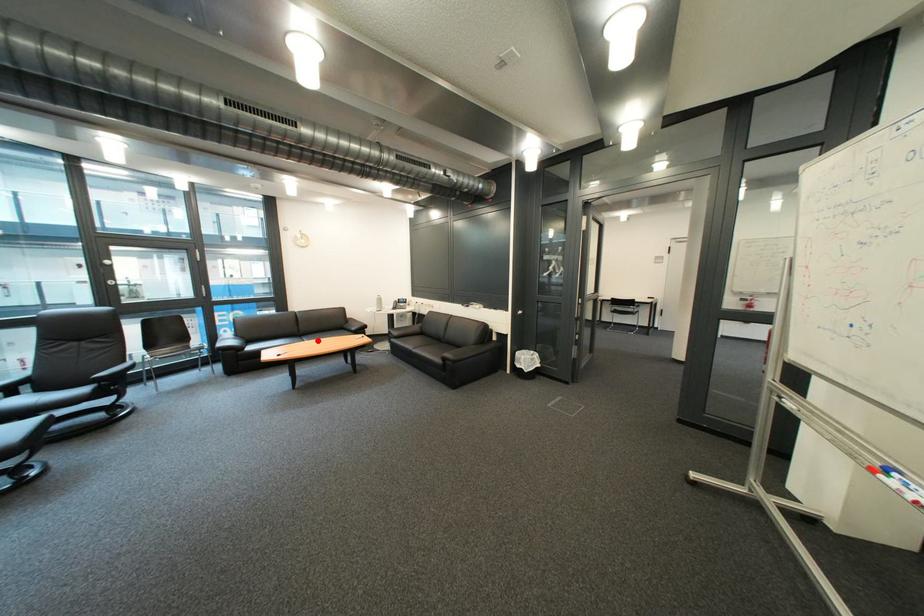
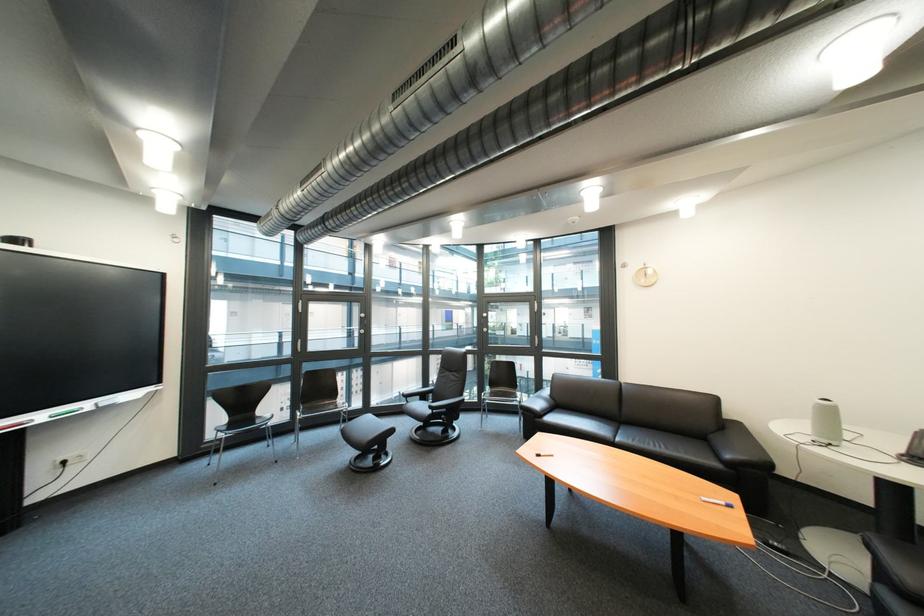
Question: I am providing you with two images of the same scene from different viewpoints. A red point is marked on the first image. At the location where the point appears in image 1, is it still visible in image 2?

Choices:
 (A) Yes
 (B) No

Answer: (A)